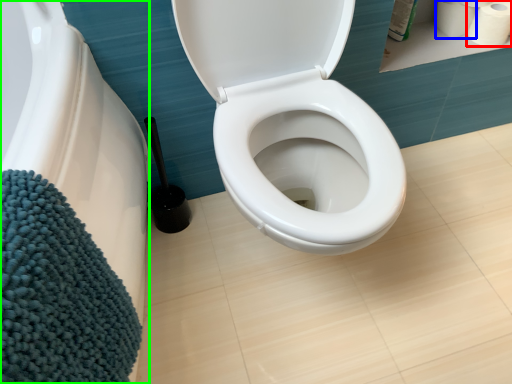
Question: Estimate the real-world distances between objects in this image. Which object is farther from toilet paper (highlighted by a red box), toilet paper (highlighted by a blue box) or bath (highlighted by a green box)?

Choices:
 (A) toilet paper
 (B) bath

Answer: (B)